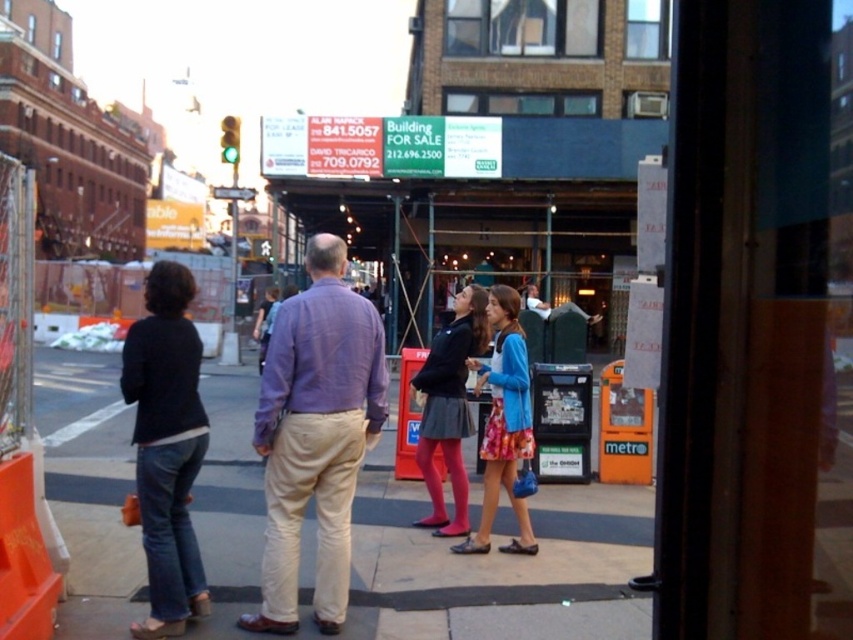
Question: Can you confirm if floral fabric dress at center is positioned to the left of matte black skirt at center?

Choices:
 (A) yes
 (B) no

Answer: (B)

Question: Does floral fabric dress at center have a greater width compared to matte black skirt at center?

Choices:
 (A) no
 (B) yes

Answer: (B)

Question: Which of the following is the farthest from the observer?

Choices:
 (A) smooth concrete sidewalk at center
 (B) matte black skirt at center
 (C) purple cotton shirt at center
 (D) floral fabric dress at center

Answer: (B)

Question: Among these points, which one is nearest to the camera?

Choices:
 (A) click(x=376, y=326)
 (B) click(x=161, y=429)

Answer: (B)

Question: Which point is farther to the camera?

Choices:
 (A) floral fabric dress at center
 (B) purple cotton shirt at center
 (C) matte black skirt at center

Answer: (C)

Question: Can you confirm if purple cotton shirt at center is wider than matte black skirt at center?

Choices:
 (A) no
 (B) yes

Answer: (B)